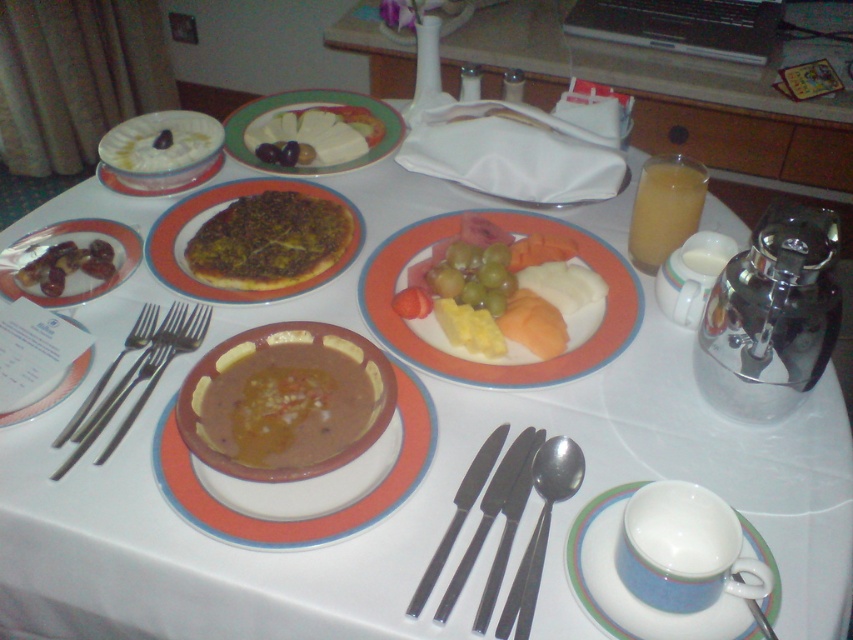
Question: Is silver metallic spoon at lower right positioned before white ceramic plate at upper left?

Choices:
 (A) yes
 (B) no

Answer: (A)

Question: Among these objects, which one is nearest to the camera?

Choices:
 (A) silver/black metal knife at lower center
 (B) white ceramic plate at upper left

Answer: (A)

Question: Is smooth white cheese at center thinner than silver metallic fork at left?

Choices:
 (A) no
 (B) yes

Answer: (A)

Question: Which of the following is the closest to the observer?

Choices:
 (A) white ceramic plate at lower right
 (B) black metal knife at lower center
 (C) brown crumbly pizza at center
 (D) white ceramic plate at upper left

Answer: (A)

Question: Is brown matte plate at left positioned in front of white ceramic bowl at upper left?

Choices:
 (A) no
 (B) yes

Answer: (B)

Question: Which object is closer to the camera taking this photo?

Choices:
 (A) white creamy dessert at upper left
 (B) white smooth cheese at center
 (C) smooth white cheese at center

Answer: (C)